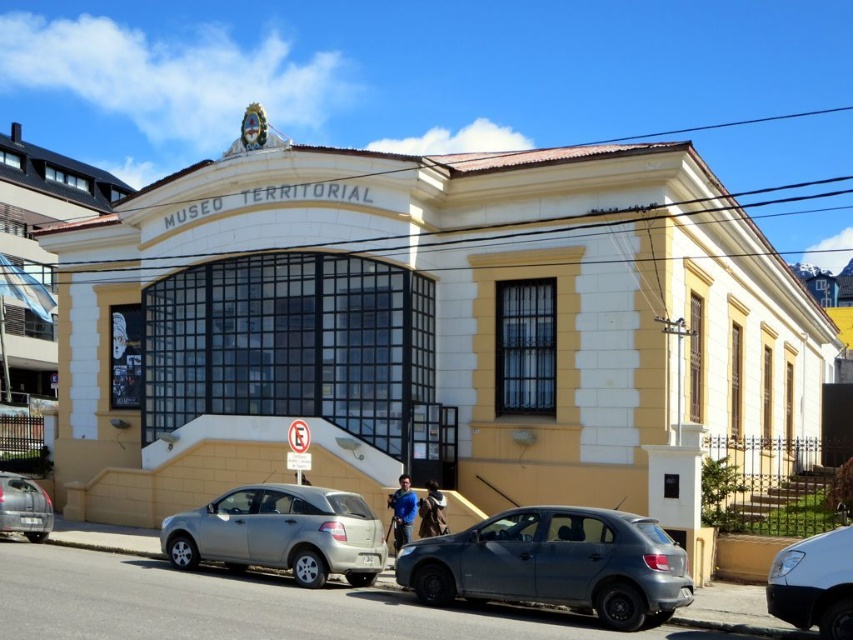
Question: Does white glossy car at lower right appear under silver metallic car at lower left?

Choices:
 (A) no
 (B) yes

Answer: (A)

Question: Is the position of matte gray hatchback at lower center more distant than that of white glossy car at lower right?

Choices:
 (A) yes
 (B) no

Answer: (A)

Question: Which of the following is the closest to the observer?

Choices:
 (A) matte gray hatchback at lower center
 (B) white glossy car at lower right

Answer: (B)

Question: Is matte gray hatchback at lower center positioned in front of silver metallic hatchback at lower left?

Choices:
 (A) no
 (B) yes

Answer: (B)

Question: Which point is farther to the camera?

Choices:
 (A) silver metallic hatchback at lower left
 (B) silver metallic car at lower left
 (C) white glossy car at lower right

Answer: (B)

Question: Which object appears closest to the camera in this image?

Choices:
 (A) silver metallic car at lower left
 (B) white glossy car at lower right

Answer: (B)